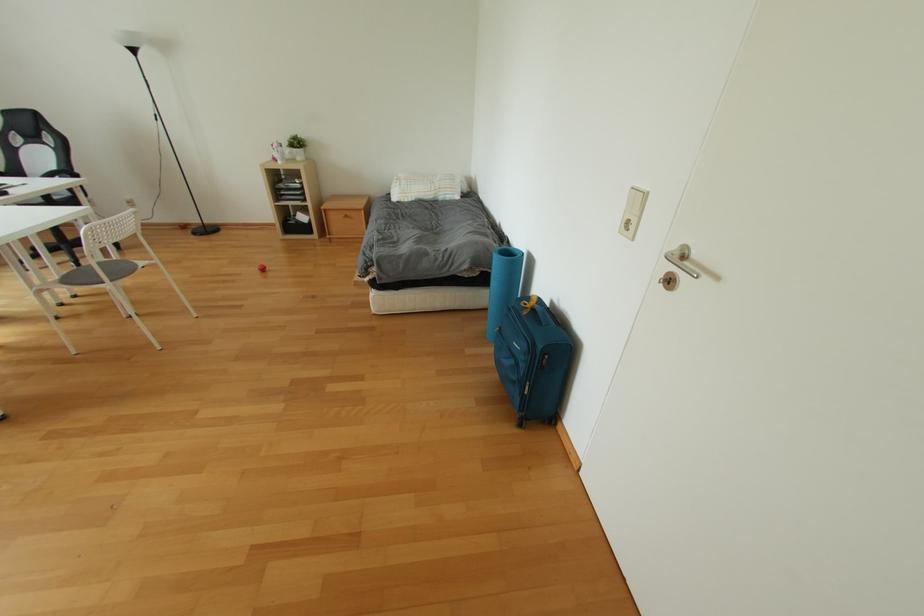
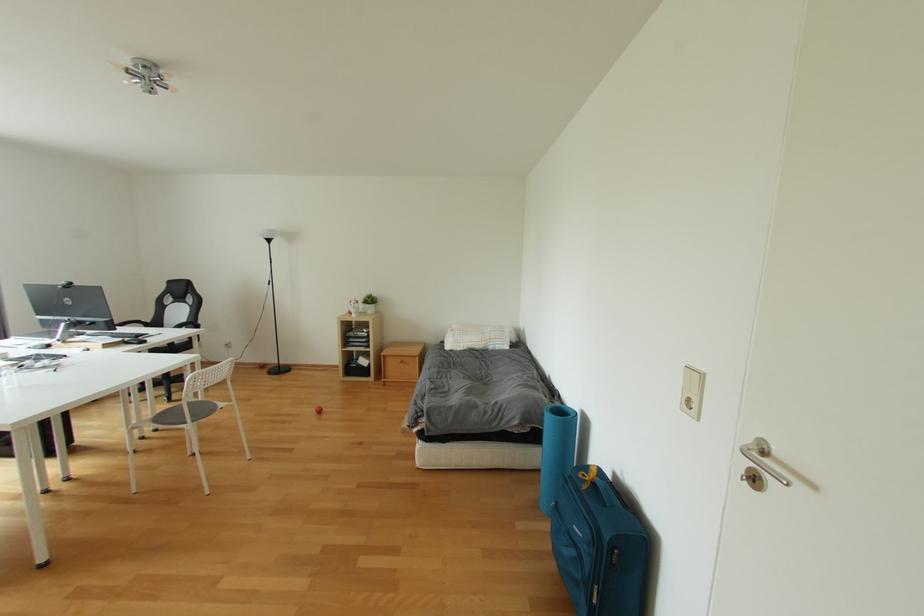
Question: In a continuous first-person perspective shot, in which direction is the camera moving?

Choices:
 (A) Left
 (B) Right
 (C) Forward
 (D) Backward

Answer: (D)